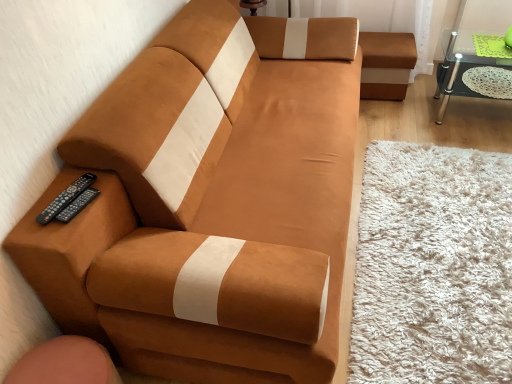
Question: Does black plastic remote at lower left, positioned as the second remote in left-to-right order, lie behind suede-like brown couch at left?

Choices:
 (A) yes
 (B) no

Answer: (A)

Question: Can you confirm if black plastic remote at lower left, the 1th remote when ordered from right to left, is positioned to the left of suede-like brown couch at left?

Choices:
 (A) yes
 (B) no

Answer: (A)

Question: Considering the relative positions of black plastic remote at lower left, the 1th remote when ordered from right to left, and suede-like brown couch at left in the image provided, is black plastic remote at lower left, the 1th remote when ordered from right to left, to the right of suede-like brown couch at left from the viewer's perspective?

Choices:
 (A) yes
 (B) no

Answer: (B)

Question: Is black plastic remote at lower left, positioned as the second remote in left-to-right order, placed right next to suede-like brown couch at left?

Choices:
 (A) no
 (B) yes

Answer: (A)

Question: Does black plastic remote at lower left, the 1th remote when ordered from right to left, have a lesser width compared to suede-like brown couch at left?

Choices:
 (A) yes
 (B) no

Answer: (A)

Question: Is black plastic remote at lower left, positioned as the second remote in left-to-right order, oriented away from suede-like brown couch at left?

Choices:
 (A) yes
 (B) no

Answer: (A)

Question: Does black plastic remote at lower left, which is counted as the second remote, starting from the right, have a larger size compared to transparent glass table at upper right?

Choices:
 (A) no
 (B) yes

Answer: (A)

Question: Does black plastic remote at lower left, which ranks as the first remote in left-to-right order, contain transparent glass table at upper right?

Choices:
 (A) no
 (B) yes

Answer: (A)

Question: Is black plastic remote at lower left, which ranks as the first remote in left-to-right order, to the left of transparent glass table at upper right from the viewer's perspective?

Choices:
 (A) yes
 (B) no

Answer: (A)

Question: From a real-world perspective, is black plastic remote at lower left, which ranks as the first remote in left-to-right order, over transparent glass table at upper right?

Choices:
 (A) yes
 (B) no

Answer: (A)

Question: Is black plastic remote at lower left, which is counted as the second remote, starting from the right, thinner than transparent glass table at upper right?

Choices:
 (A) no
 (B) yes

Answer: (B)

Question: Is black plastic remote at lower left, which is counted as the second remote, starting from the right, outside transparent glass table at upper right?

Choices:
 (A) no
 (B) yes

Answer: (B)

Question: Is transparent glass table at upper right facing away from black plastic remote at lower left, which is counted as the second remote, starting from the right?

Choices:
 (A) yes
 (B) no

Answer: (B)